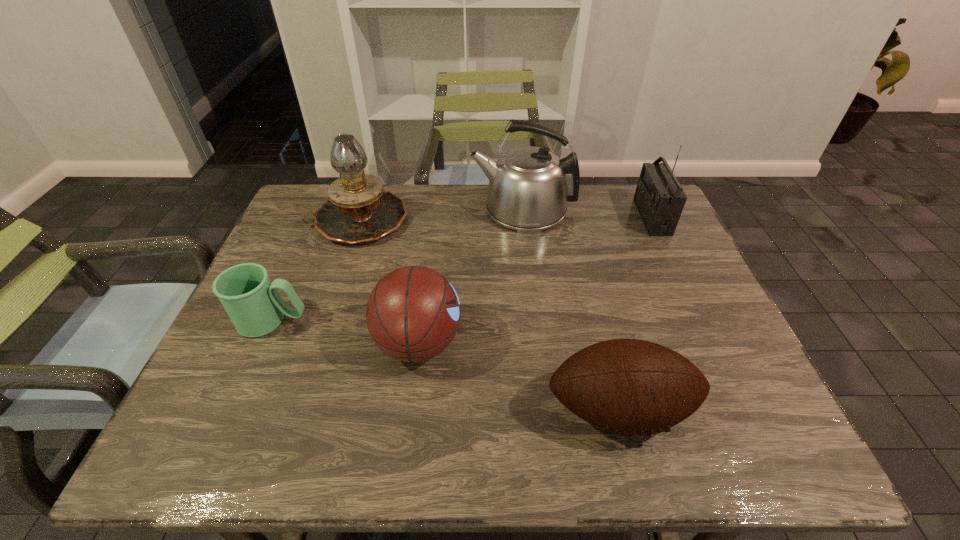
This screenshot has height=540, width=960. In order to click on free space that satisfies the following two spatial constraints: 1. on the side of the basketball with the handle; 2. on the left side of the shortest object in this screenshot , I will do `click(263, 342)`.